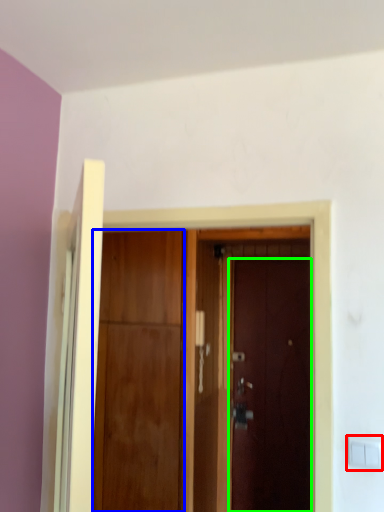
Question: Considering the real-world distances, which object is closest to light switch (highlighted by a red box)? door (highlighted by a blue box) or door (highlighted by a green box).

Choices:
 (A) door
 (B) door

Answer: (A)